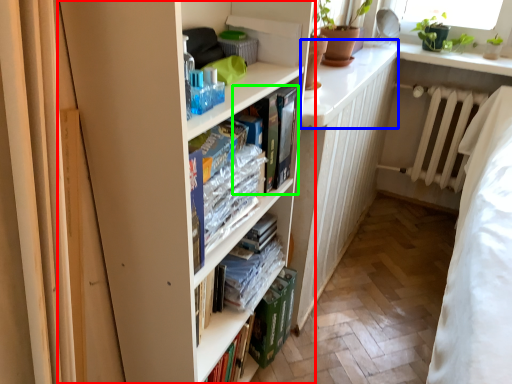
Question: Considering the real-world distances, which object is farthest from bookcase (highlighted by a red box)? counter top (highlighted by a blue box) or book (highlighted by a green box)?

Choices:
 (A) counter top
 (B) book

Answer: (A)